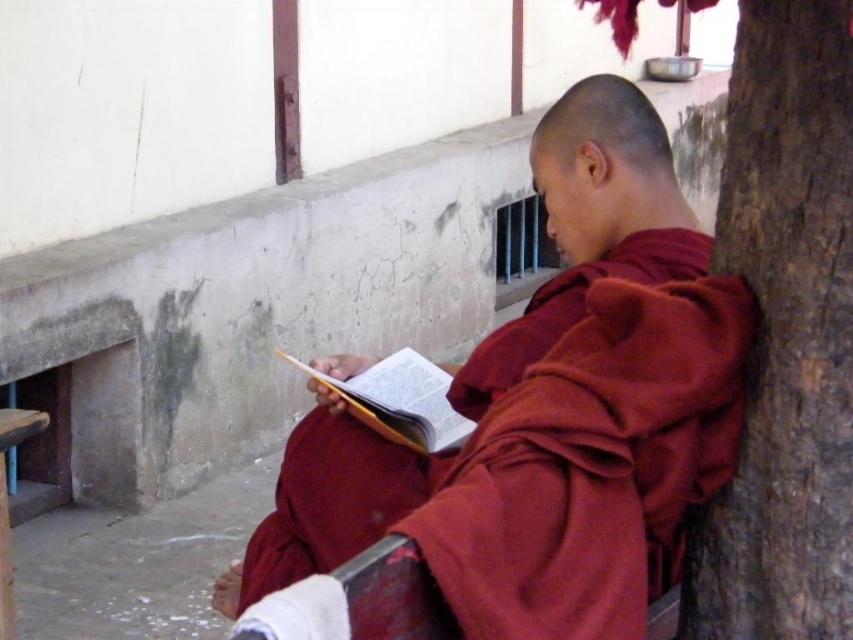
Question: Can you confirm if brown rough bark at right is positioned above maroon cloth at center?

Choices:
 (A) yes
 (B) no

Answer: (A)

Question: Is maroon cloth at center further to the viewer compared to yellow paper book at center?

Choices:
 (A) no
 (B) yes

Answer: (A)

Question: Estimate the real-world distances between objects in this image. Which object is farther from the maroon cloth at center?

Choices:
 (A) brown rough bark at right
 (B) yellow paper book at center

Answer: (A)

Question: Which object is the farthest from the brown rough bark at right?

Choices:
 (A) maroon cloth at center
 (B) yellow paper book at center

Answer: (B)

Question: Does brown rough bark at right have a larger size compared to yellow paper book at center?

Choices:
 (A) no
 (B) yes

Answer: (B)

Question: Which object is positioned closest to the brown rough bark at right?

Choices:
 (A) yellow paper book at center
 (B) maroon cloth at center

Answer: (B)